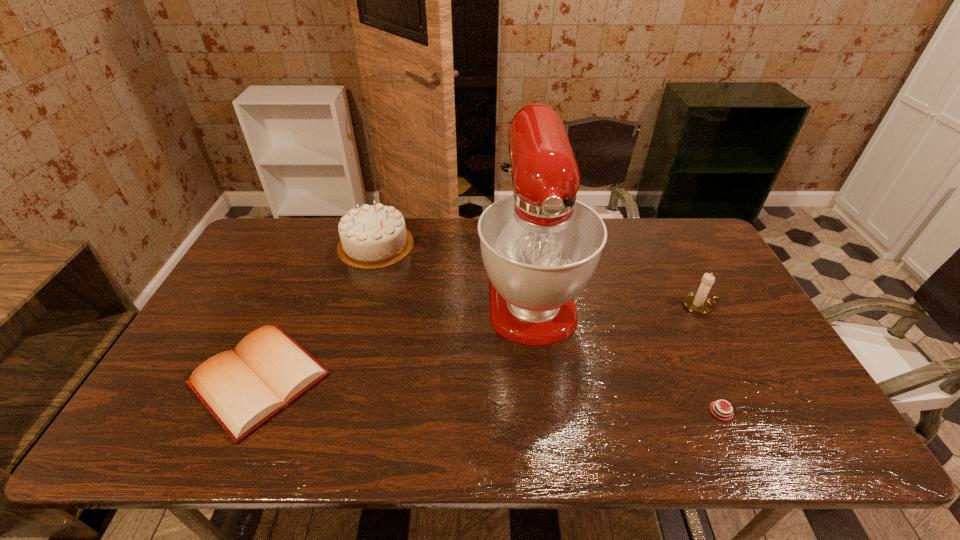
Where is `free space located on the left of the shortest object`? The width and height of the screenshot is (960, 540). free space located on the left of the shortest object is located at coordinates pos(659,411).

You are a GUI agent. You are given a task and a screenshot of the screen. Output one action in this format:
    pyautogui.click(x=<x>, y=<y>)
    Task: Click on the mixer at the far edge
    
    Given the screenshot: What is the action you would take?
    pyautogui.click(x=540, y=246)

This screenshot has height=540, width=960. In order to click on birthday cake at the far edge in this screenshot , I will do `click(372, 236)`.

Find the location of a particular element. The image size is (960, 540). Bible that is at the near edge is located at coordinates (244, 388).

You are a GUI agent. You are given a task and a screenshot of the screen. Output one action in this format:
    pyautogui.click(x=<x>, y=<y>)
    Task: Click on the chocolate cake present at the near edge
    The image size is (960, 540).
    Given the screenshot: What is the action you would take?
    pyautogui.click(x=727, y=416)

Where is `object situated at the left edge`? object situated at the left edge is located at coordinates (244, 388).

Where is `candle holder that is at the right edge`? This screenshot has width=960, height=540. candle holder that is at the right edge is located at coordinates (699, 303).

In order to click on chocolate cake present at the right edge in this screenshot , I will do `click(727, 416)`.

You are a GUI agent. You are given a task and a screenshot of the screen. Output one action in this format:
    pyautogui.click(x=<x>, y=<y>)
    Task: Click on the object that is at the near left corner
    The image size is (960, 540).
    Given the screenshot: What is the action you would take?
    pyautogui.click(x=244, y=388)

This screenshot has width=960, height=540. Find the location of `object at the near right corner`. object at the near right corner is located at coordinates (727, 416).